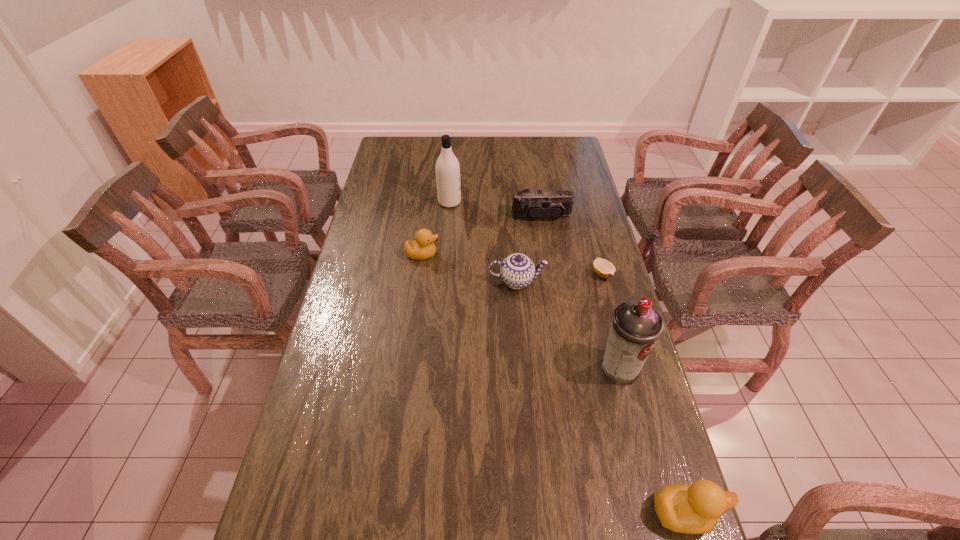
You are a GUI agent. You are given a task and a screenshot of the screen. Output one action in this format:
    pyautogui.click(x=<x>, y=<y>)
    Task: Click on the object at the near right corner
    The height and width of the screenshot is (540, 960).
    Given the screenshot: What is the action you would take?
    pyautogui.click(x=696, y=509)

Where is `free space at the far edge`? free space at the far edge is located at coordinates (473, 156).

You are a GUI agent. You are given a task and a screenshot of the screen. Output one action in this format:
    pyautogui.click(x=<x>, y=<y>)
    Task: Click on the vacant space at the left edge of the desktop
    
    Given the screenshot: What is the action you would take?
    pyautogui.click(x=342, y=420)

Locate an element on the screen. vacant space at the right edge of the desktop is located at coordinates (572, 242).

In the image, there is a desktop. Identify the location of vacant area at the far left corner. Image resolution: width=960 pixels, height=540 pixels. (399, 138).

Find the location of a particular element. free space between the chinaware and the sixth nearest object is located at coordinates (529, 248).

You are a GUI agent. You are given a task and a screenshot of the screen. Output one action in this format:
    pyautogui.click(x=<x>, y=<y>)
    Task: Click on the unoccupied position between the third farthest object and the second nearest object
    
    Given the screenshot: What is the action you would take?
    pyautogui.click(x=520, y=312)

Identify the location of vacant point located between the second nearest object and the left duckling. The height and width of the screenshot is (540, 960). (520, 312).

Locate an element on the screen. The image size is (960, 540). empty space between the camcorder and the lemon is located at coordinates (572, 245).

This screenshot has height=540, width=960. I want to click on vacant area between the lemon and the chinaware, so click(x=560, y=277).